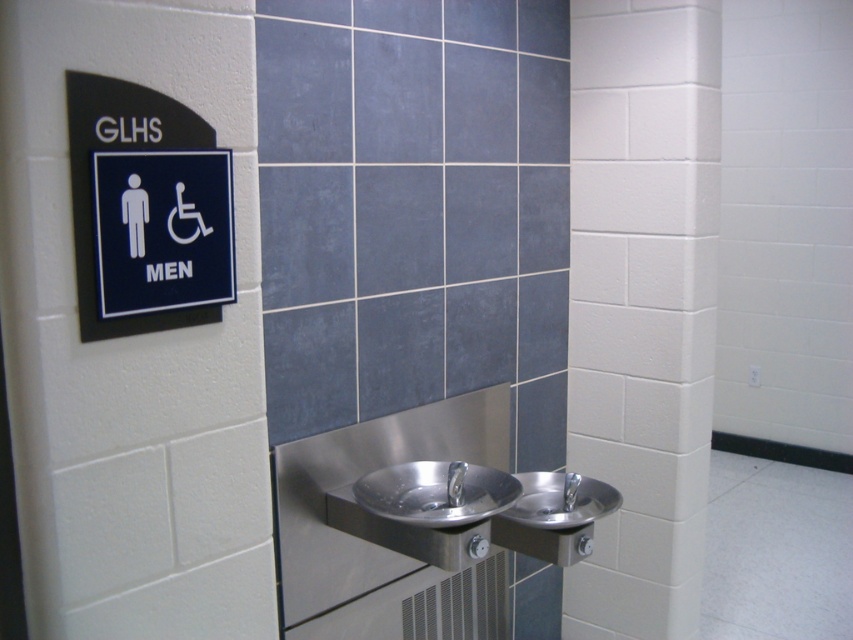
Looking at this image, who is shorter, black plastic sign at upper left or stainless steel sink at center?

With less height is stainless steel sink at center.

From the picture: Can you confirm if black plastic sign at upper left is positioned to the right of stainless steel sink at center?

Incorrect, black plastic sign at upper left is not on the right side of stainless steel sink at center.

Does point (119, 150) lie behind point (421, 499)?

No, (119, 150) is closer to viewer.

At what (x,y) coordinates should I click in order to perform the action: click on black plastic sign at upper left. Please return your answer as a coordinate pair (x, y). The height and width of the screenshot is (640, 853). Looking at the image, I should click on (146, 211).

Between black plastic sign at upper left and polished stainless steel sink at center, which one is positioned higher?

black plastic sign at upper left is above.

Is black plastic sign at upper left wider than polished stainless steel sink at center?

In fact, black plastic sign at upper left might be narrower than polished stainless steel sink at center.

Which is behind, point (71, 118) or point (527, 504)?

Positioned behind is point (527, 504).

In order to click on black plastic sign at upper left in this screenshot , I will do [146, 211].

Is point (486, 472) positioned before point (537, 490)?

Yes, it is.

Identify the location of stainless steel sink at center. (436, 492).

At what (x,y) coordinates should I click in order to perform the action: click on stainless steel sink at center. Please return your answer as a coordinate pair (x, y). Image resolution: width=853 pixels, height=640 pixels. Looking at the image, I should click on (436, 492).